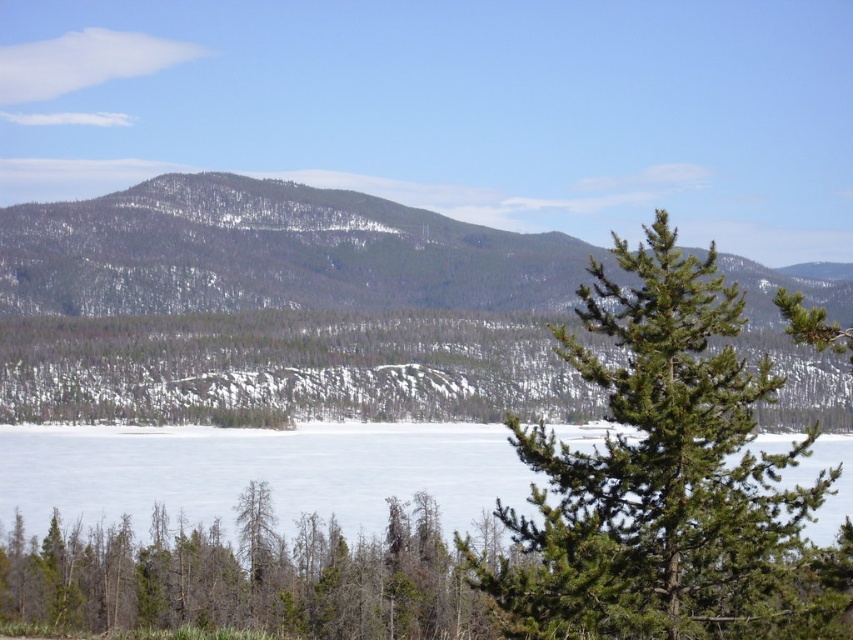
Looking at this image, does green needle-like tree at center come in front of white frozen lake at lower center?

Yes, it is.

How far apart are green needle-like tree at center and white frozen lake at lower center?

They are 65.12 meters apart.

Does point (605, 474) lie in front of point (390, 477)?

Yes, it is in front of point (390, 477).

Locate an element on the screen. green needle-like tree at center is located at coordinates point(666,481).

Between green needle-like tree at center and snow-covered mountain at center, which one has less height?

green needle-like tree at center is shorter.

Measure the distance between green needle-like tree at center and camera.

They are 40.83 meters apart.

Where is `green needle-like tree at center`? This screenshot has width=853, height=640. green needle-like tree at center is located at coordinates (666, 481).

Between point (253, 616) and point (88, 513), which one is positioned in front?

Point (253, 616) is in front.

Can you confirm if brown/dried wood trees at lower center is positioned to the right of white frozen lake at lower center?

Incorrect, brown/dried wood trees at lower center is not on the right side of white frozen lake at lower center.

Does point (74, 624) come in front of point (227, 525)?

Yes, point (74, 624) is in front of point (227, 525).

Where is `brown/dried wood trees at lower center`? This screenshot has width=853, height=640. brown/dried wood trees at lower center is located at coordinates [x=242, y=579].